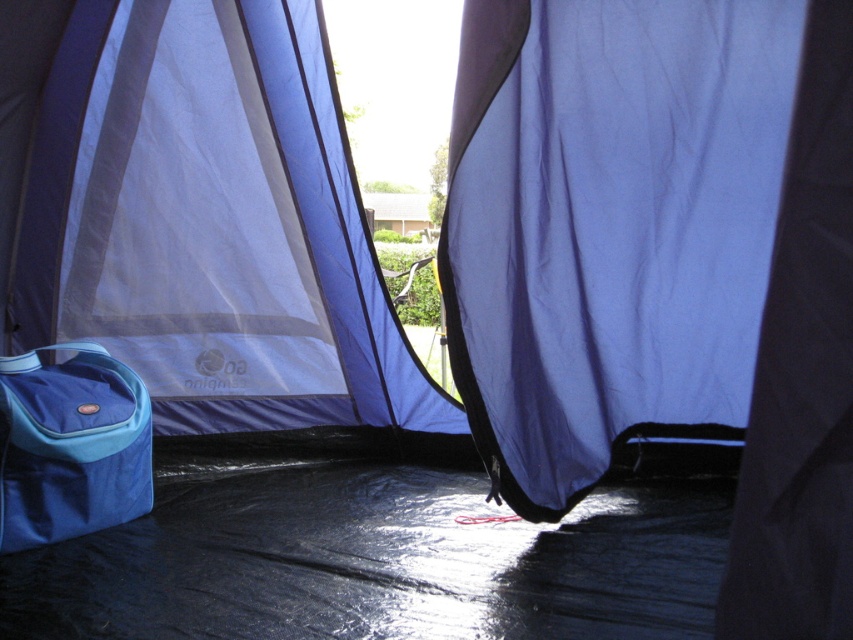
You are setting up a tent and need to place a camping gear organizer between the blue fabric curtain at center and the blue fabric bag at lower left. Can you fit it if the organizer requires 3 feet of space?

The blue fabric curtain at center and blue fabric bag at lower left are 3.69 feet apart, so yes, the camping gear organizer requiring 3 feet of space can be placed between them since there is enough space.

You are setting up a tent and need to determine if the blue fabric bag at lower left can be placed under the blue fabric curtain at center without being blocked. Based on their heights, can the bag fit underneath the curtain?

The blue fabric curtain at center has a greater height than the blue fabric bag at lower left, so the bag can be placed underneath the curtain without being blocked as the curtain is taller.